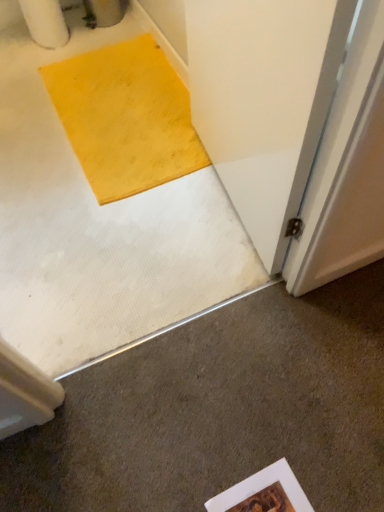
Question: Considering the positions of wooden frame at lower center and white smooth concrete at lower left in the image, is wooden frame at lower center taller or shorter than white smooth concrete at lower left?

Choices:
 (A) short
 (B) tall

Answer: (A)

Question: Is wooden frame at lower center wider or thinner than white smooth concrete at lower left?

Choices:
 (A) wide
 (B) thin

Answer: (B)

Question: Is point (274, 493) closer or farther from the camera than point (337, 282)?

Choices:
 (A) closer
 (B) farther

Answer: (A)

Question: Considering the positions of point (3, 462) and point (213, 501), is point (3, 462) closer or farther from the camera than point (213, 501)?

Choices:
 (A) closer
 (B) farther

Answer: (B)

Question: From the image's perspective, is white smooth concrete at lower left above or below wooden frame at lower center?

Choices:
 (A) below
 (B) above

Answer: (B)

Question: Is white smooth concrete at lower left wider or thinner than wooden frame at lower center?

Choices:
 (A) wide
 (B) thin

Answer: (A)

Question: Would you say white smooth concrete at lower left is to the left or to the right of wooden frame at lower center in the picture?

Choices:
 (A) right
 (B) left

Answer: (B)